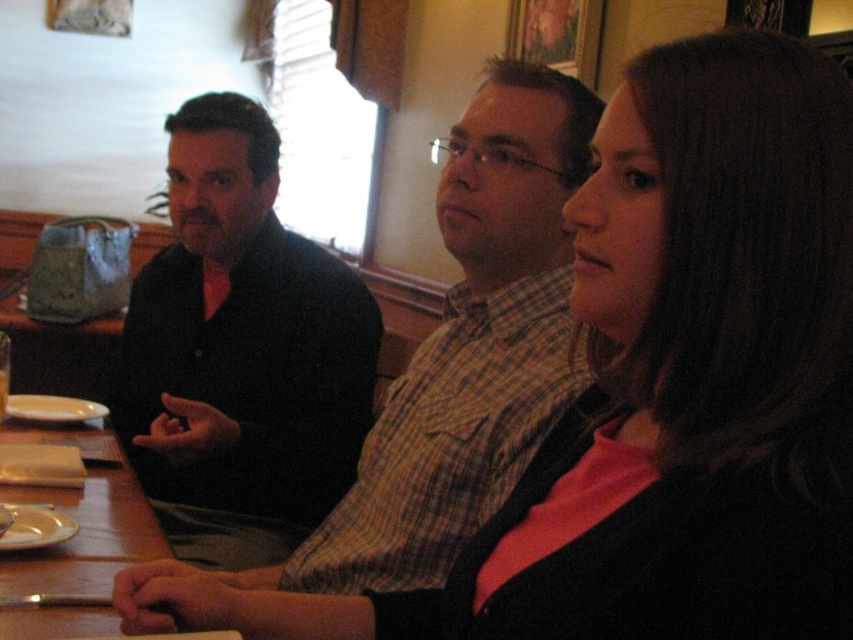
Between wooden table at lower left and white glossy plate at lower left, which one appears on the left side from the viewer's perspective?

wooden table at lower left

Between wooden table at lower left and white glossy plate at lower left, which one has less height?

white glossy plate at lower left is shorter.

Find the location of a particular element. wooden table at lower left is located at coordinates (82, 518).

Who is higher up, wooden table at lower left or white matte plate at lower left?

Positioned higher is white matte plate at lower left.

Image resolution: width=853 pixels, height=640 pixels. What do you see at coordinates (82, 518) in the screenshot? I see `wooden table at lower left` at bounding box center [82, 518].

Identify the location of wooden table at lower left. The height and width of the screenshot is (640, 853). (82, 518).

The image size is (853, 640). What do you see at coordinates (241, 352) in the screenshot?
I see `black matte shirt at left` at bounding box center [241, 352].

How much distance is there between black matte shirt at left and white glossy plate at lower left?

black matte shirt at left and white glossy plate at lower left are 24.43 inches apart from each other.

Describe the element at coordinates (241, 352) in the screenshot. This screenshot has height=640, width=853. I see `black matte shirt at left` at that location.

Image resolution: width=853 pixels, height=640 pixels. In order to click on black matte shirt at left in this screenshot , I will do `click(241, 352)`.